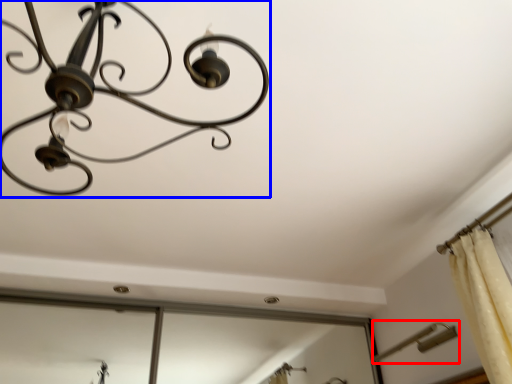
Question: Which point is closer to the camera, lamp (highlighted by a red box) or lamp (highlighted by a blue box)?

Choices:
 (A) lamp
 (B) lamp

Answer: (B)